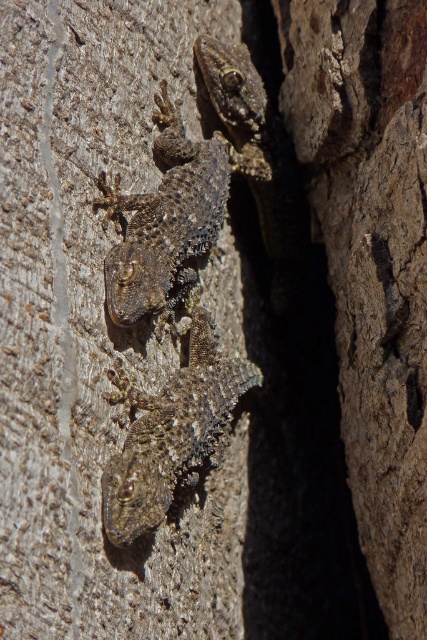
You are a wildlife photographer aiming to capture closeup shots of both the rough textured lizard at center and the scaly brown lizard at center. Based on their sizes, which lizard would require you to use a longer focal length to avoid disturbing them?

The rough textured lizard at center is larger than the scaly brown lizard at center, so you would need to use a longer focal length for the rough textured lizard at center to maintain a safe distance and avoid disturbing it.

Looking at this image, you are a biologist observing two lizards on a rock wall. You notice a rough textured lizard at center and a scaly brown lizard at center. Which lizard is smaller in height?

The rough textured lizard at center is shorter than the scaly brown lizard at center, so the rough textured lizard at center is smaller in height.

You are an observer looking at the image. Where is the rough textured lizard at center located in terms of its 2D coordinates?

The rough textured lizard at center is located at the 2D coordinates point (x=172, y=433).